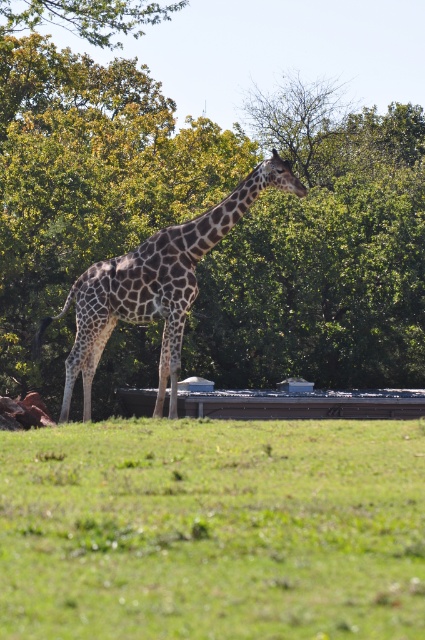
You are a photographer trying to capture a detailed shot of the green grass at center and the spotted fur giraffe at center. Which object will appear larger in your photo if you focus on it?

The green grass at center will appear larger in the photo because it is closer to the viewer than the spotted fur giraffe at center.

You are a bird looking for a place to land. You see the green leafy tree at center and the green grass at center. Which one is to the left?

The green leafy tree at center is positioned on the left side of green grass at center, so the green leafy tree at center is to the left.